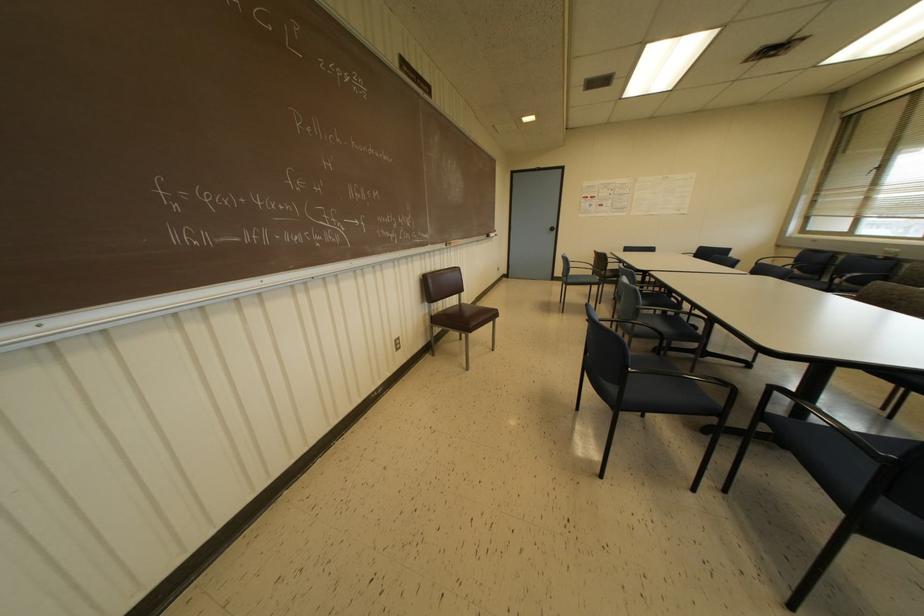
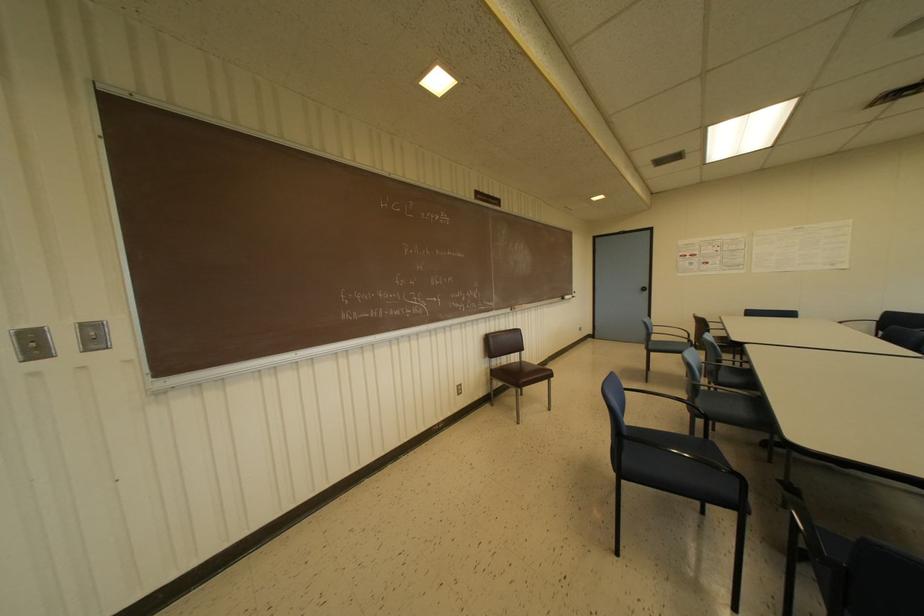
Find the pixel in the second image that matches (x=568, y=280) in the first image.

(650, 346)